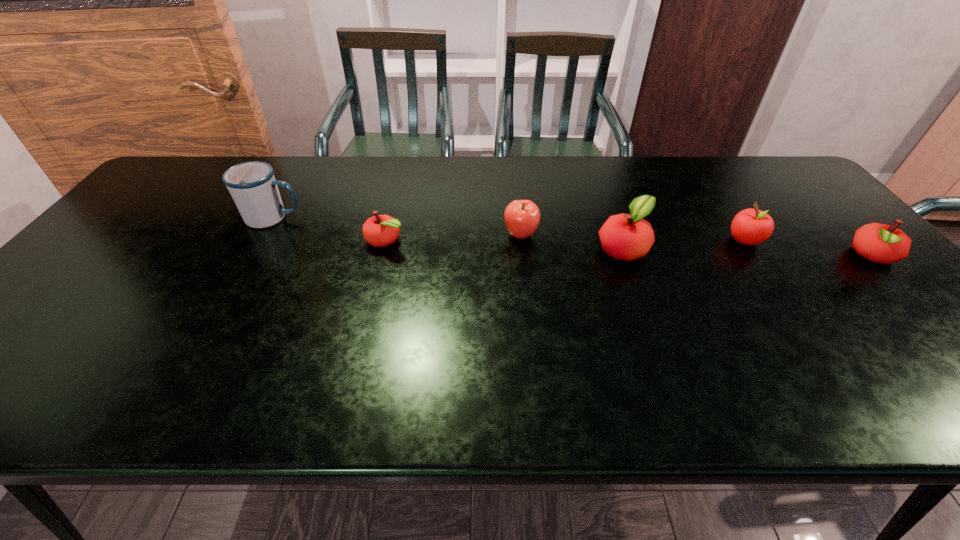
The height and width of the screenshot is (540, 960). What are the coordinates of `free location that satisfies the following two spatial constraints: 1. on the handle side of the second apple from left to right; 2. on the right side of the mug` in the screenshot? It's located at (264, 234).

This screenshot has height=540, width=960. Identify the location of blank space that satisfies the following two spatial constraints: 1. on the handle side of the shortest object; 2. on the left side of the mug. (261, 240).

Where is `free location that satisfies the following two spatial constraints: 1. on the back side of the fifth object from right to left; 2. on the left side of the fourth object from right to left`? The width and height of the screenshot is (960, 540). free location that satisfies the following two spatial constraints: 1. on the back side of the fifth object from right to left; 2. on the left side of the fourth object from right to left is located at coordinates (387, 234).

Where is `vacant point that satisfies the following two spatial constraints: 1. on the handle side of the tallest object; 2. on the back side of the fourth object from left to right`? This screenshot has width=960, height=540. vacant point that satisfies the following two spatial constraints: 1. on the handle side of the tallest object; 2. on the back side of the fourth object from left to right is located at coordinates (256, 248).